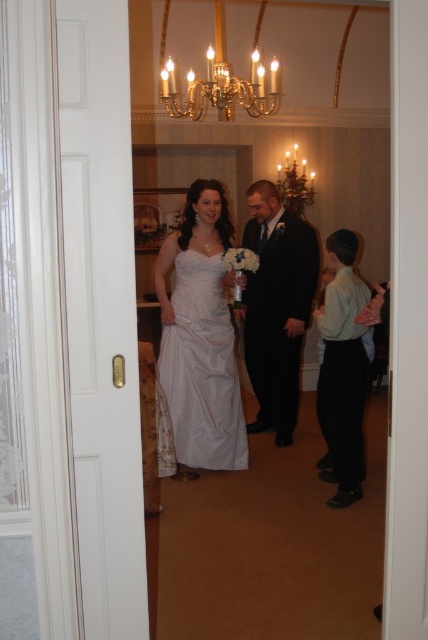
Looking at this image, between white satin dress at center and black satin suit at center, which one is positioned higher?

Positioned higher is black satin suit at center.

Can you confirm if white satin dress at center is shorter than black satin suit at center?

Correct, white satin dress at center is not as tall as black satin suit at center.

Find the location of a particular element. white satin dress at center is located at coordinates (202, 368).

The width and height of the screenshot is (428, 640). Find the location of `white satin dress at center`. white satin dress at center is located at coordinates (202, 368).

Who is shorter, white satin dress at center or black satin suit at right?

white satin dress at center

The image size is (428, 640). In order to click on white satin dress at center in this screenshot , I will do `click(202, 368)`.

Image resolution: width=428 pixels, height=640 pixels. In order to click on white satin dress at center in this screenshot , I will do [x=202, y=368].

Does black satin suit at center have a greater width compared to black satin suit at right?

Yes, black satin suit at center is wider than black satin suit at right.

Can you confirm if black satin suit at center is positioned to the right of black satin suit at right?

No, black satin suit at center is not to the right of black satin suit at right.

Image resolution: width=428 pixels, height=640 pixels. I want to click on black satin suit at center, so [276, 307].

Locate an element on the screen. The image size is (428, 640). black satin suit at center is located at coordinates point(276,307).